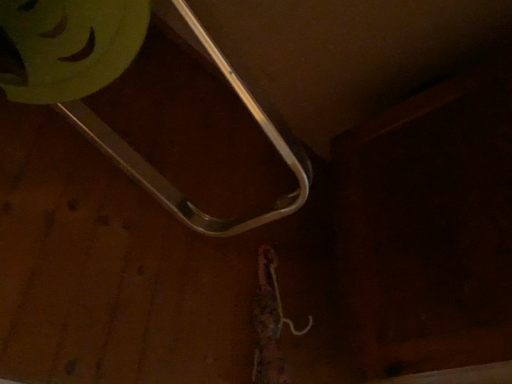
What do you see at coordinates (175, 187) in the screenshot?
I see `polished metal exhaust hood at center` at bounding box center [175, 187].

In order to face polished metal exhaust hood at center, should I rotate leftwards or rightwards?

Rotate left and turn 11.568 degrees.

This screenshot has width=512, height=384. Identify the location of polished metal exhaust hood at center. (175, 187).

Where is `polished metal exhaust hood at center`? polished metal exhaust hood at center is located at coordinates (175, 187).